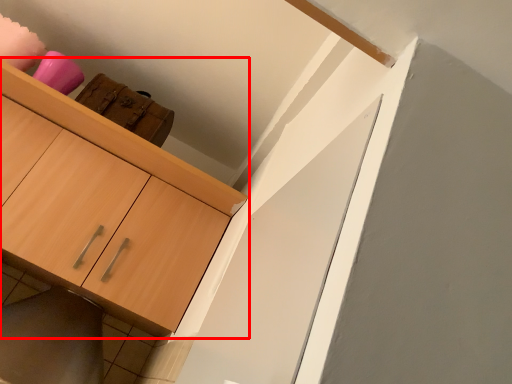
Question: From the image's perspective, what is the correct spatial relationship of cabinetry (annotated by the red box) in relation to tile?

Choices:
 (A) below
 (B) above

Answer: (B)